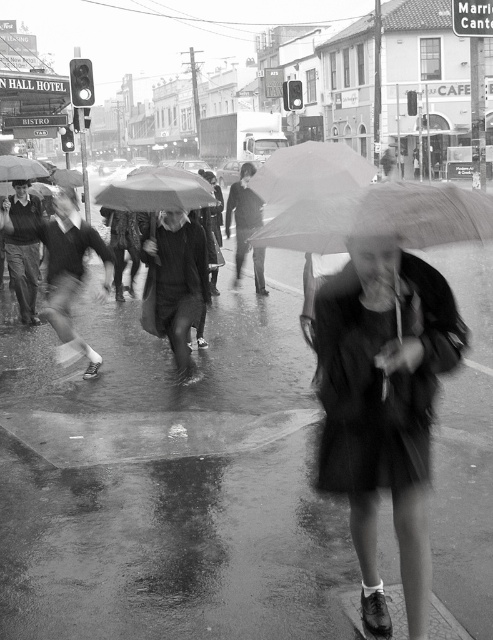
From the picture: In this rainy urban scene, there is a wet asphalt pavement at center and a matte black sweater at left. Which object is positioned lower in the image?

The wet asphalt pavement at center is positioned lower than the matte black sweater at left.

You are a pedestrian trying to cross the street on a rainy day. You notice the wet asphalt pavement at center and the matte black sweater at left. Which object is closer to the camera?

The matte black sweater at left is closer to the camera because it is taller than the wet asphalt pavement at center.

Looking at this image, where is the black matte coat at center located in the image?

The black matte coat at center is located at point (384,406) in the image.